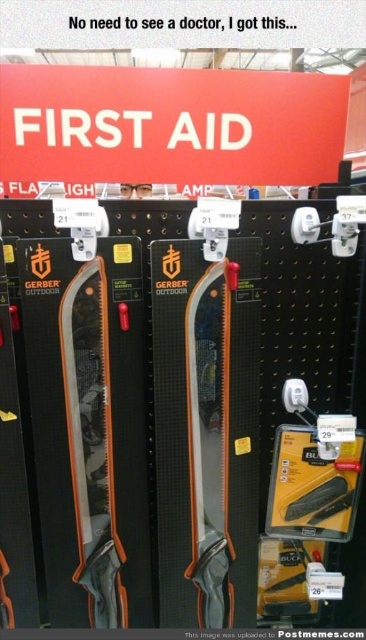
This screenshot has height=640, width=366. What do you see at coordinates (91, 442) in the screenshot? I see `matte black saw at center` at bounding box center [91, 442].

What do you see at coordinates (91, 442) in the screenshot?
I see `matte black saw at center` at bounding box center [91, 442].

Find the location of a particular element. matte black saw at center is located at coordinates (91, 442).